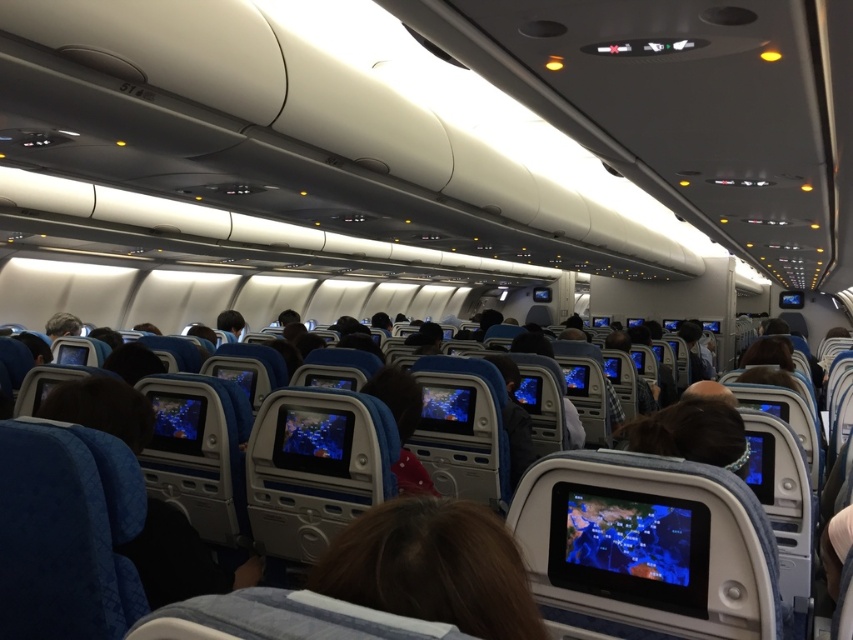
You are seated in the airplane cabin and need to reach a point in the cabin. The point is located at coordinates point (x=354, y=577). If your arms can extend 80 centimeters, can you reach that point without moving from your seat?

A: The point (x=354, y=577) is 86.88 centimeters away from you, which is beyond your 80 centimeter reach. You cannot reach it without moving from your seat.

You are seated in the airplane cabin and notice a brown hair at center and a blue glossy screen at center. Which object is nearer to you?

The brown hair at center is closer to the viewer than the blue glossy screen at center.

You are a flight attendant walking down the aisle of the airplane cabin. You notice a brown hair at center and a blue glossy screen at center. Which object is shorter in height?

The brown hair at center is shorter than the blue glossy screen at center.